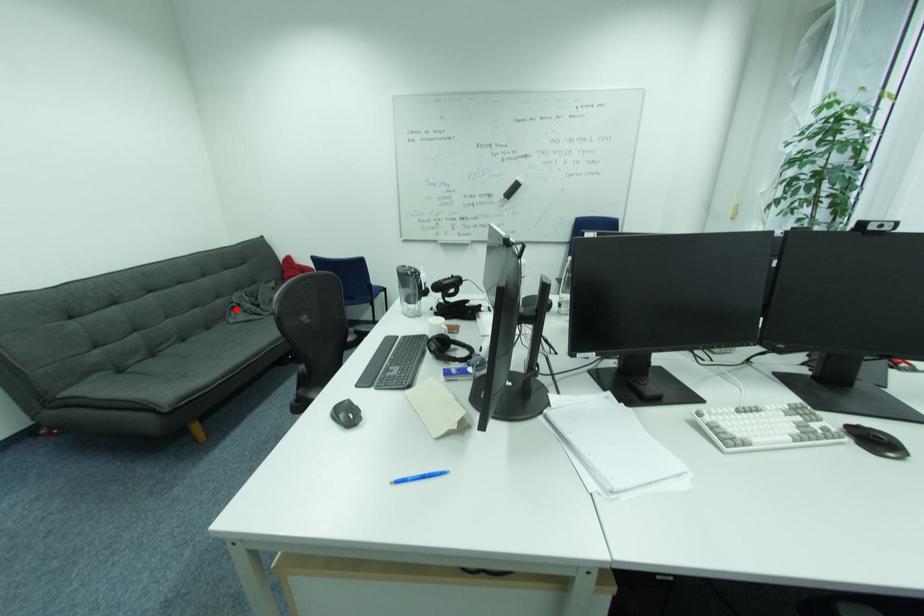
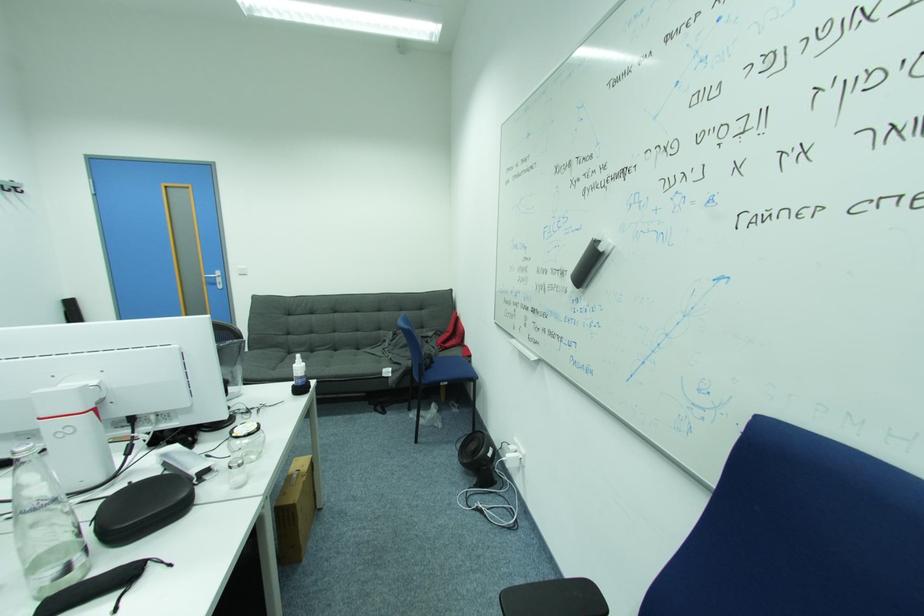
Question: I am providing you with two images of the same scene from different viewpoints. Image1 has a red point marked. In image2, the corresponding 3D location appears at what relative position? Reply with the corresponding letter.

Choices:
 (A) Closer
 (B) Farther

Answer: (B)